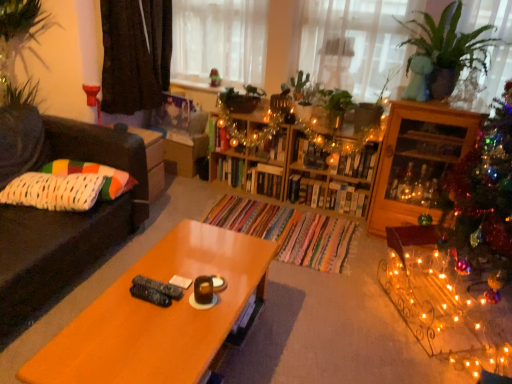
Find the location of a particular element. The width and height of the screenshot is (512, 384). vacant space in between wooden cabinet at right and wooden coffee table at center is located at coordinates (321, 278).